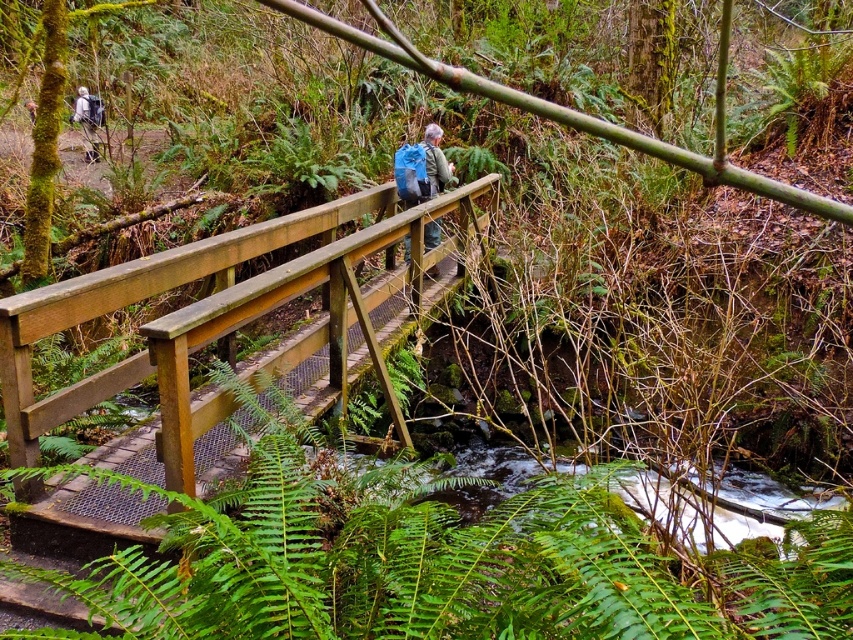
Question: Which point is closer to the camera?

Choices:
 (A) wooden rail at center
 (B) green leafy fern at center

Answer: (B)

Question: Can you confirm if green leafy fern at center is wider than blue backpack at center?

Choices:
 (A) no
 (B) yes

Answer: (B)

Question: Is green leafy fern at center in front of blue backpack at center?

Choices:
 (A) yes
 (B) no

Answer: (A)

Question: Is green leafy fern at center below wooden rail at center?

Choices:
 (A) no
 (B) yes

Answer: (B)

Question: Which point appears closest to the camera in this image?

Choices:
 (A) (33, 438)
 (B) (440, 132)

Answer: (A)

Question: Which of the following is the farthest from the observer?

Choices:
 (A) blue backpack at center
 (B) green leafy fern at center

Answer: (A)